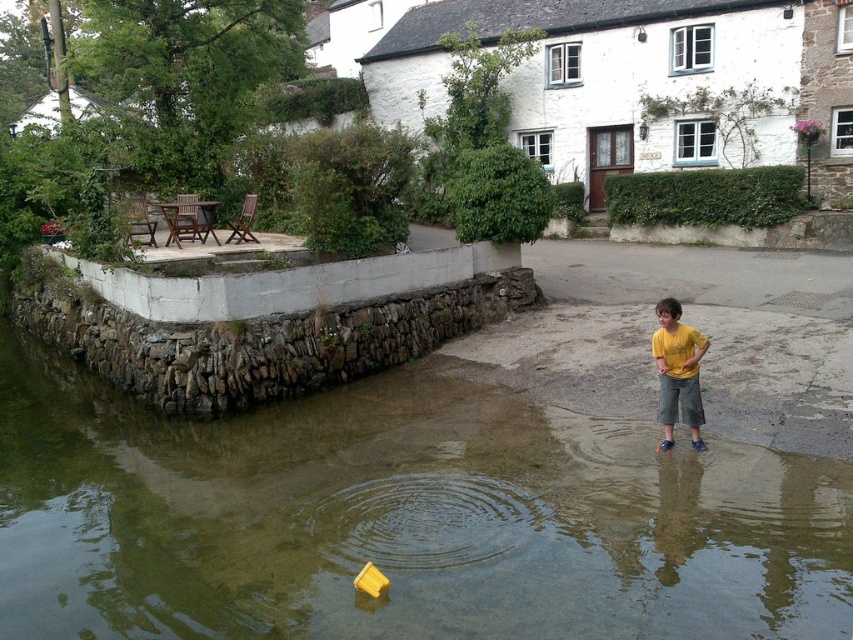
Which is above, greenish water at lower left or yellow cotton shirt at lower right?

yellow cotton shirt at lower right

Does greenish water at lower left have a larger size compared to yellow cotton shirt at lower right?

Indeed, greenish water at lower left has a larger size compared to yellow cotton shirt at lower right.

Which is in front, point (534, 592) or point (674, 308)?

Point (534, 592) is in front.

Find the location of a particular element. The width and height of the screenshot is (853, 640). greenish water at lower left is located at coordinates (399, 518).

Can you confirm if greenish water at lower left is positioned above yellow fabric at lower right?

No, greenish water at lower left is not above yellow fabric at lower right.

Measure the distance from greenish water at lower left to yellow fabric at lower right.

greenish water at lower left and yellow fabric at lower right are 21.57 feet apart.

From the picture: Who is more distant from viewer, (19, 618) or (590, 349)?

Point (590, 349)

Identify the location of greenish water at lower left. (399, 518).

The width and height of the screenshot is (853, 640). Identify the location of yellow fabric at lower right. (776, 378).

Does point (579, 328) come farther from viewer compared to point (674, 346)?

Yes, it is.

The height and width of the screenshot is (640, 853). I want to click on yellow fabric at lower right, so click(776, 378).